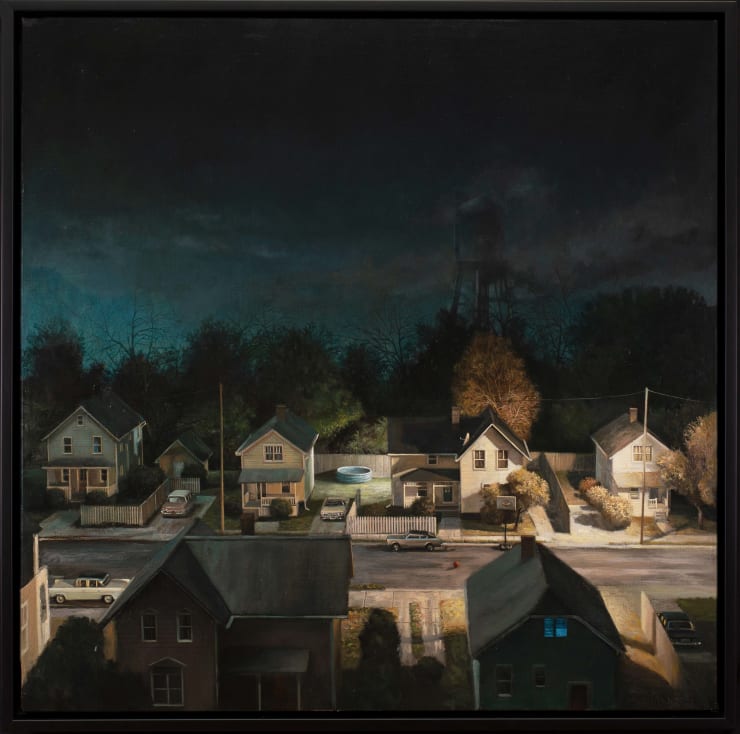
Find the location of a particular element. window is located at coordinates (559, 631).